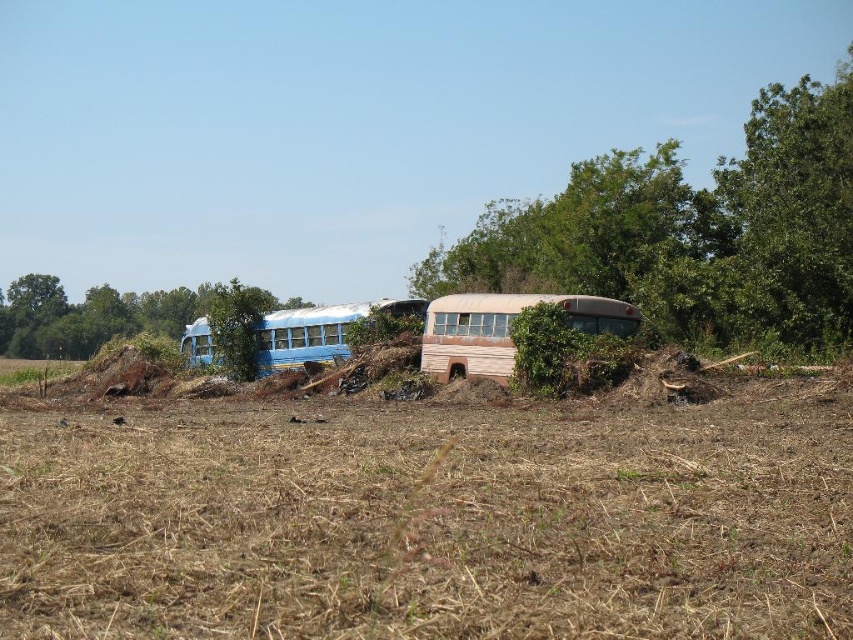
Question: Can you confirm if green leafy tree at upper right is bigger than blue matte school bus at center-left?

Choices:
 (A) yes
 (B) no

Answer: (A)

Question: Which point is farther from the camera taking this photo?

Choices:
 (A) (132, 294)
 (B) (341, 317)
 (C) (514, 298)
 (D) (790, 291)

Answer: (A)

Question: Among these points, which one is farthest from the camera?

Choices:
 (A) (828, 205)
 (B) (247, 458)

Answer: (A)

Question: Where is green leafy tree at left located in relation to rusty wood school bus at center in the image?

Choices:
 (A) above
 (B) below

Answer: (B)

Question: Which point appears farthest from the camera in this image?

Choices:
 (A) (502, 332)
 (B) (448, 285)
 (C) (53, 340)
 (D) (305, 352)

Answer: (C)

Question: Observing the image, what is the correct spatial positioning of brown dry grass at center in reference to green leafy tree at upper right?

Choices:
 (A) left
 (B) right

Answer: (A)